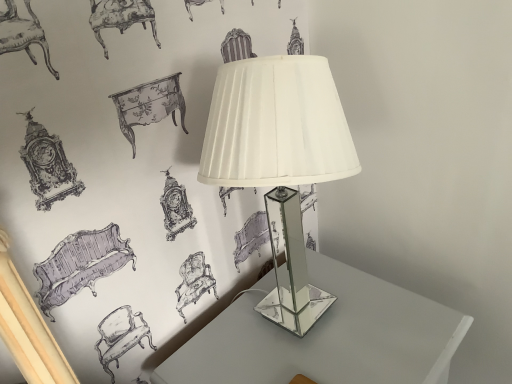
You are a GUI agent. You are given a task and a screenshot of the screen. Output one action in this format:
    pyautogui.click(x=<x>, y=<y>)
    Task: Click on the clear glass table at center
    Image resolution: width=512 pixels, height=384 pixels.
    Given the screenshot: What is the action you would take?
    pyautogui.click(x=324, y=336)

What is the approximate width of clear glass table at center?

The width of clear glass table at center is 16.89 inches.

This screenshot has width=512, height=384. What do you see at coordinates (324, 336) in the screenshot?
I see `clear glass table at center` at bounding box center [324, 336].

Measure the distance between clear glass lamp at center and camera.

clear glass lamp at center and camera are 21.21 inches apart.

The height and width of the screenshot is (384, 512). In order to click on clear glass lamp at center in this screenshot , I will do `click(280, 160)`.

The width and height of the screenshot is (512, 384). What do you see at coordinates (280, 160) in the screenshot?
I see `clear glass lamp at center` at bounding box center [280, 160].

Find the location of `clear glass table at center`. clear glass table at center is located at coordinates (324, 336).

Looking at this image, based on their positions, is clear glass table at center located to the left or right of clear glass lamp at center?

Based on their positions, clear glass table at center is located to the right of clear glass lamp at center.

Which is in front, clear glass table at center or clear glass lamp at center?

Positioned in front is clear glass lamp at center.

Is point (185, 378) closer or farther from the camera than point (301, 324)?

Point (185, 378).

From the image's perspective, is clear glass table at center located beneath clear glass lamp at center?

Yes, from the image's perspective, clear glass table at center is below clear glass lamp at center.

From a real-world perspective, is clear glass table at center positioned over clear glass lamp at center based on gravity?

Actually, clear glass table at center is physically below clear glass lamp at center in the real world.

In terms of width, does clear glass table at center look wider or thinner when compared to clear glass lamp at center?

In the image, clear glass table at center appears to be wider than clear glass lamp at center.

Is clear glass table at center taller or shorter than clear glass lamp at center?

Considering their sizes, clear glass table at center has more height than clear glass lamp at center.

Which of these two, clear glass table at center or clear glass lamp at center, is bigger?

With larger size is clear glass table at center.

Is clear glass table at center not inside clear glass lamp at center?

Absolutely, clear glass table at center is external to clear glass lamp at center.

Is clear glass table at center far from clear glass lamp at center?

They are positioned close to each other.

Could you tell me if clear glass table at center is turned towards clear glass lamp at center?

No, clear glass table at center is not turned towards clear glass lamp at center.

How different are the orientations of clear glass table at center and clear glass lamp at center in degrees?

They differ by 3.83 degrees in their facing directions.

Measure the distance between clear glass table at center and clear glass lamp at center.

The distance of clear glass table at center from clear glass lamp at center is 14.85 inches.

I want to click on table to the right of clear glass lamp at center, so click(x=324, y=336).

Is clear glass lamp at center at the left side of clear glass table at center?

Correct, you'll find clear glass lamp at center to the left of clear glass table at center.

Is the position of clear glass lamp at center more distant than that of clear glass table at center?

No, clear glass lamp at center is closer to the camera.

Considering the positions of points (334, 168) and (332, 291), is point (334, 168) farther from camera compared to point (332, 291)?

No, (334, 168) is closer to viewer.

In the scene shown: From the image's perspective, does clear glass lamp at center appear higher than clear glass table at center?

Yes, from the image's perspective, clear glass lamp at center is over clear glass table at center.

From a real-world perspective, is clear glass lamp at center physically below clear glass table at center?

No.

Does clear glass lamp at center have a lesser width compared to clear glass table at center?

Indeed, clear glass lamp at center has a lesser width compared to clear glass table at center.

Does clear glass lamp at center have a greater height compared to clear glass table at center?

Incorrect, the height of clear glass lamp at center is not larger of that of clear glass table at center.

Does clear glass lamp at center have a larger size compared to clear glass table at center?

Actually, clear glass lamp at center might be smaller than clear glass table at center.

Is clear glass table at center a part of clear glass lamp at center?

No, clear glass table at center is located outside of clear glass lamp at center.

Would you say clear glass lamp at center is a long distance from clear glass table at center?

No, clear glass lamp at center is in close proximity to clear glass table at center.

Could you tell me if clear glass lamp at center is turned towards clear glass table at center?

No, clear glass lamp at center is not oriented towards clear glass table at center.

Where is `table to the right of clear glass lamp at center`? This screenshot has height=384, width=512. table to the right of clear glass lamp at center is located at coordinates (324, 336).

Identify the location of lamp in front of the clear glass table at center. This screenshot has width=512, height=384. (280, 160).

In order to click on lamp on the left side of clear glass table at center in this screenshot , I will do `click(280, 160)`.